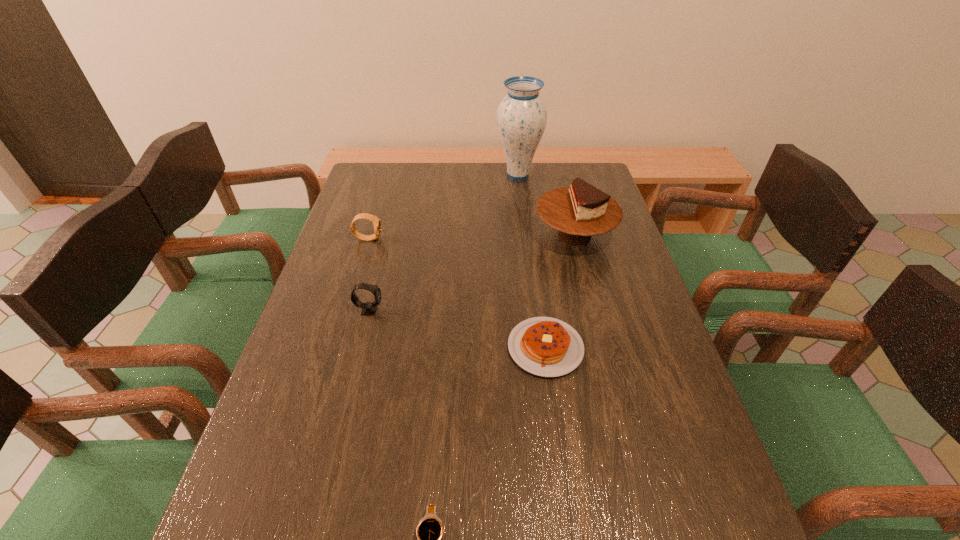
The height and width of the screenshot is (540, 960). Find the location of `blank region between the second nearest object and the farthest watch`. blank region between the second nearest object and the farthest watch is located at coordinates (457, 293).

You are a GUI agent. You are given a task and a screenshot of the screen. Output one action in this format:
    pyautogui.click(x=<x>, y=<y>)
    Task: Click on the vacant space that's between the tallest object and the farthest watch
    
    Given the screenshot: What is the action you would take?
    pyautogui.click(x=444, y=207)

Where is `blank region between the second farthest watch and the vase`? blank region between the second farthest watch and the vase is located at coordinates (444, 242).

You are a GUI agent. You are given a task and a screenshot of the screen. Output one action in this format:
    pyautogui.click(x=<x>, y=<y>)
    Task: Click on the free spot between the second farthest watch and the fifth tallest object
    This screenshot has width=960, height=540.
    Given the screenshot: What is the action you would take?
    pyautogui.click(x=458, y=329)

The image size is (960, 540). I want to click on object that is the closest one to the second nearest object, so click(x=580, y=211).

Point out which object is positioned as the nearest to the farthest watch. Please provide its 2D coordinates. Your answer should be formatted as a tuple, i.e. [(x, y)], where the tuple contains the x and y coordinates of a point satisfying the conditions above.

[(369, 308)]

Locate which watch ranks third in proximity to the tallest object. Please provide its 2D coordinates. Your answer should be formatted as a tuple, i.e. [(x, y)], where the tuple contains the x and y coordinates of a point satisfying the conditions above.

[(430, 530)]

Image resolution: width=960 pixels, height=540 pixels. What are the coordinates of `watch that stands as the second closest to the fourth object from right to left` in the screenshot? It's located at (375, 220).

The height and width of the screenshot is (540, 960). Identify the location of vacant region that satisfies the following two spatial constraints: 1. on the back side of the second shortest object; 2. on the face of the fourth farthest object. (540, 310).

Find the location of a particular element. This screenshot has width=960, height=540. vacant space that satisfies the following two spatial constraints: 1. on the face of the pancake; 2. on the left side of the fourth farthest object is located at coordinates (360, 348).